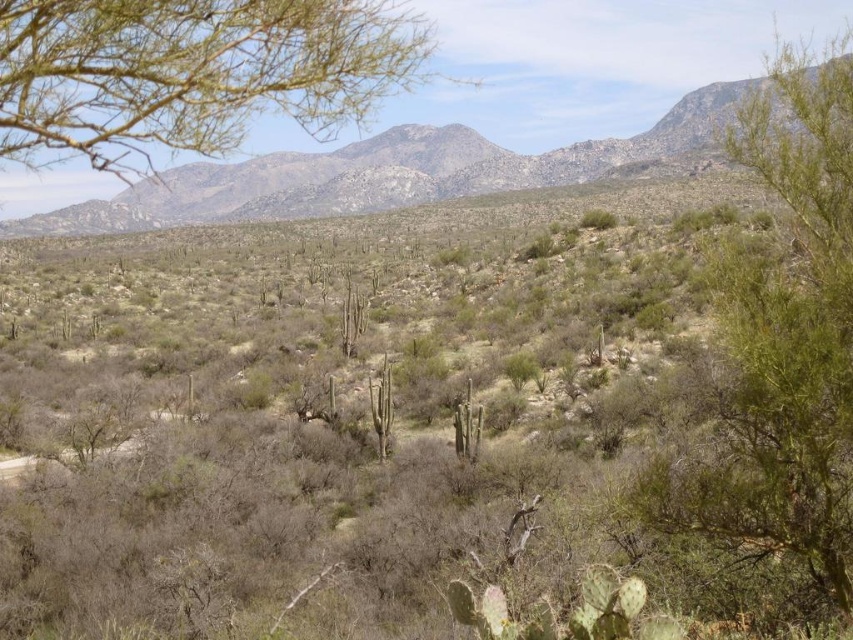
You are a desert explorer who needs to find shade. You see a green leafy bush at right and a green leafy tree at upper left. Which one would provide more shade?

The green leafy tree at upper left is larger than the green leafy bush at right, so it would provide more shade.